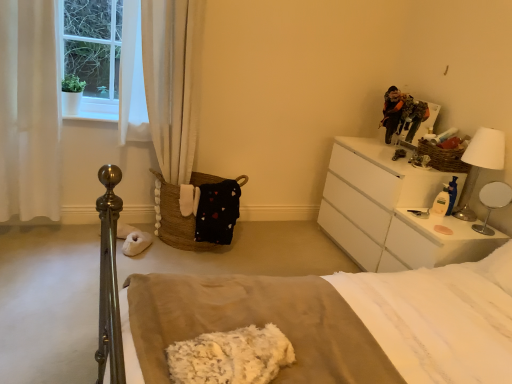
Locate an element on the screen. vacant space in white fabric curtain at left, which is counted as the first curtain, starting from the left (from a real-world perspective) is located at coordinates (33, 238).